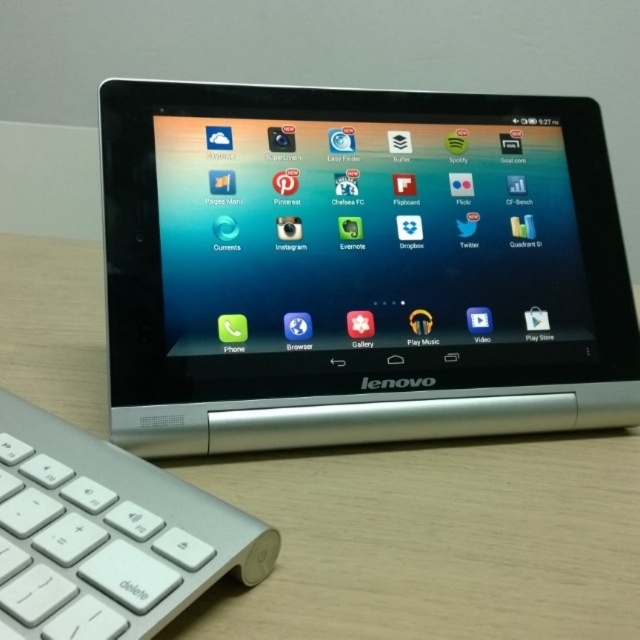
Does silver metallic tablet at center appear over white plastic keyboard at lower left?

Indeed, silver metallic tablet at center is positioned over white plastic keyboard at lower left.

Describe the element at coordinates (358, 268) in the screenshot. I see `silver metallic tablet at center` at that location.

Locate an element on the screen. The width and height of the screenshot is (640, 640). silver metallic tablet at center is located at coordinates (358, 268).

Which of these two, silver metallic tablet at center or wooden table at center, stands shorter?

Standing shorter between the two is wooden table at center.

Between point (481, 352) and point (474, 529), which one is positioned in front?

Positioned in front is point (474, 529).

Where is `silver metallic tablet at center`? The width and height of the screenshot is (640, 640). silver metallic tablet at center is located at coordinates (358, 268).

Does wooden table at center appear over white plastic keyboard at lower left?

Correct, wooden table at center is located above white plastic keyboard at lower left.

Is point (557, 483) farther from viewer compared to point (108, 573)?

Yes, it is.

You are a GUI agent. You are given a task and a screenshot of the screen. Output one action in this format:
    pyautogui.click(x=<x>, y=<y>)
    Task: Click on the wooden table at center
    
    Given the screenshot: What is the action you would take?
    pyautogui.click(x=433, y=540)